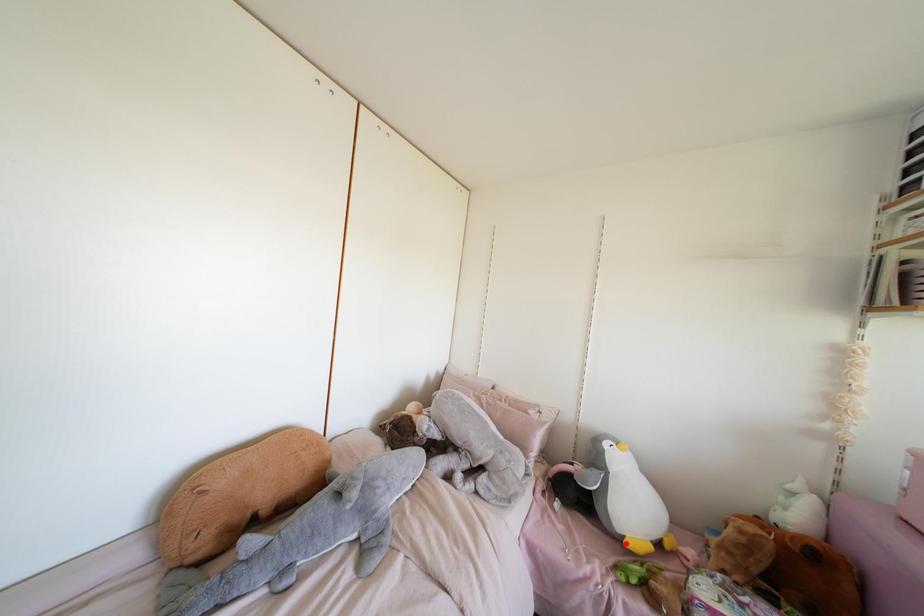
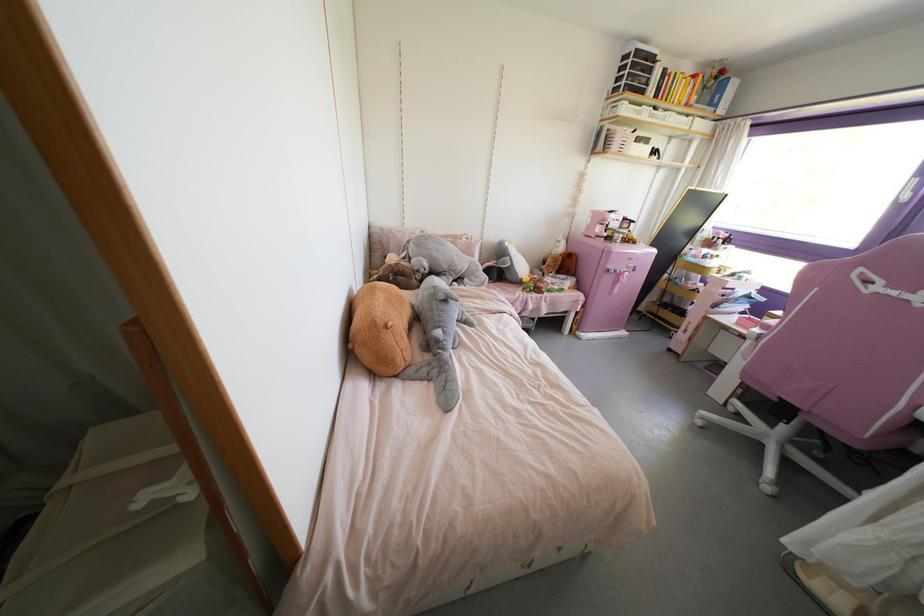
The point at the highlighted location is marked in the first image. Where is the corresponding point in the second image?

(523, 280)